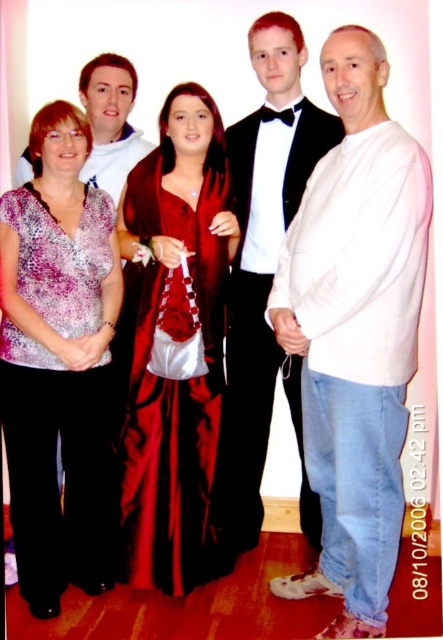
Between point (372, 102) and point (163, 369), which one is positioned in front?

Point (372, 102) is in front.

Does white cotton shirt at right come in front of satin dress at center?

Yes.

Does point (325, 529) come closer to viewer compared to point (152, 509)?

Yes, it is in front of point (152, 509).

What are the coordinates of `white cotton shirt at right` in the screenshot? It's located at (356, 330).

Can you confirm if satin dress at center is smaller than matte white tuxedo at upper center?

Actually, satin dress at center might be larger than matte white tuxedo at upper center.

Does satin dress at center have a greater height compared to matte white tuxedo at upper center?

Indeed, satin dress at center has a greater height compared to matte white tuxedo at upper center.

Describe the element at coordinates (171, 385) in the screenshot. The width and height of the screenshot is (443, 640). I see `satin dress at center` at that location.

I want to click on satin dress at center, so click(171, 385).

Which is above, matte pink blouse at left or white satin tuxedo at center?

white satin tuxedo at center

Can you confirm if matte pink blouse at left is wider than white satin tuxedo at center?

In fact, matte pink blouse at left might be narrower than white satin tuxedo at center.

Where is `matte pink blouse at left`? The height and width of the screenshot is (640, 443). matte pink blouse at left is located at coordinates (58, 358).

The height and width of the screenshot is (640, 443). I want to click on matte pink blouse at left, so click(58, 358).